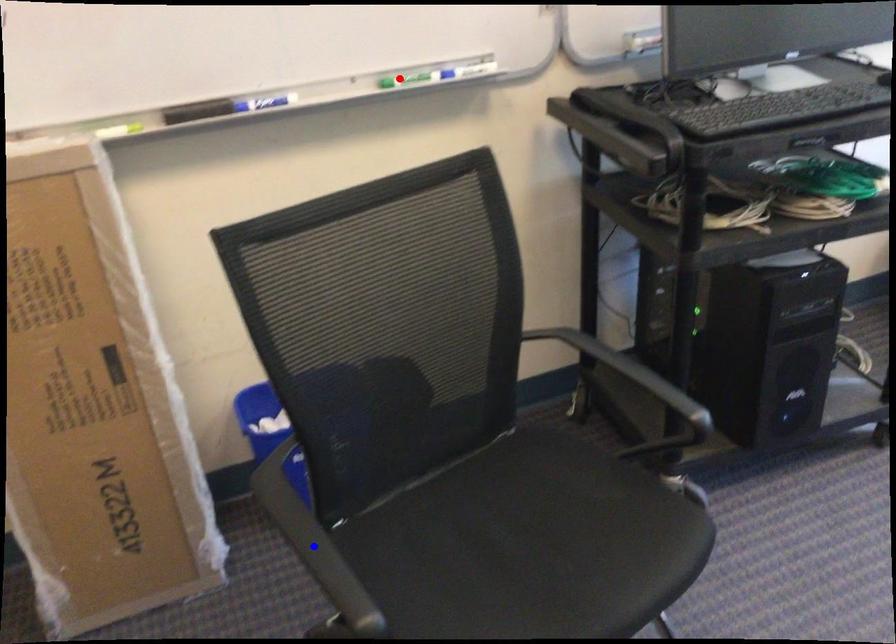
Question: Two points are marked on the image. Which point is closer to the camera?

Choices:
 (A) Blue point is closer.
 (B) Red point is closer.

Answer: (A)